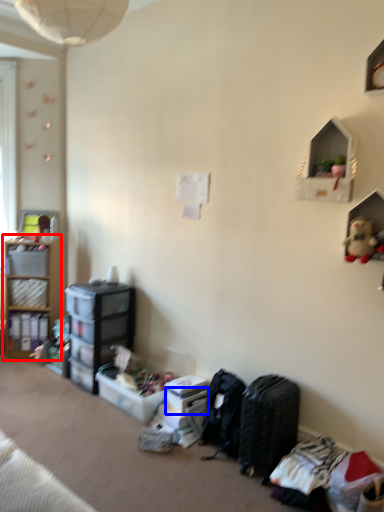
Question: Which of the following is the closest to the observer, shelf (highlighted by a red box) or storage box (highlighted by a blue box)?

Choices:
 (A) shelf
 (B) storage box

Answer: (B)